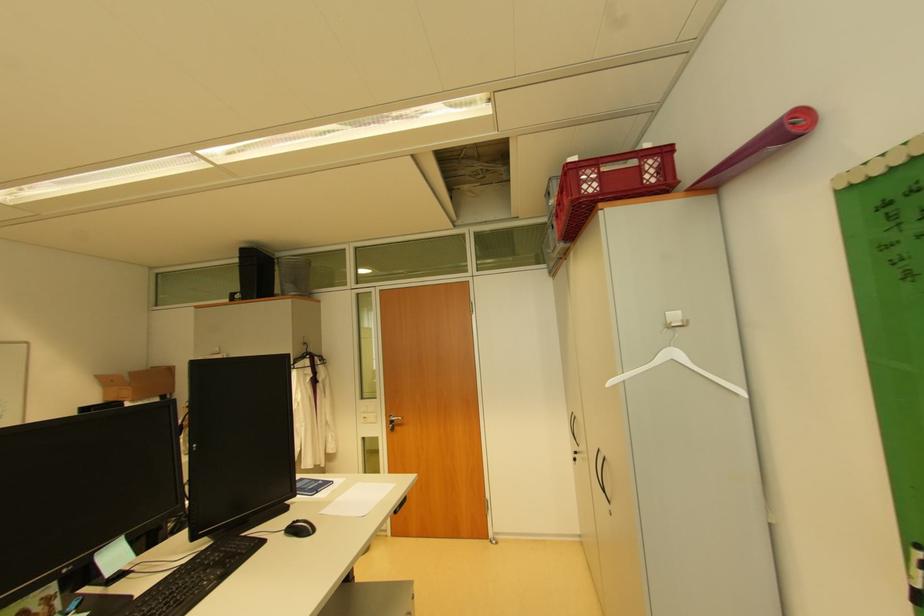
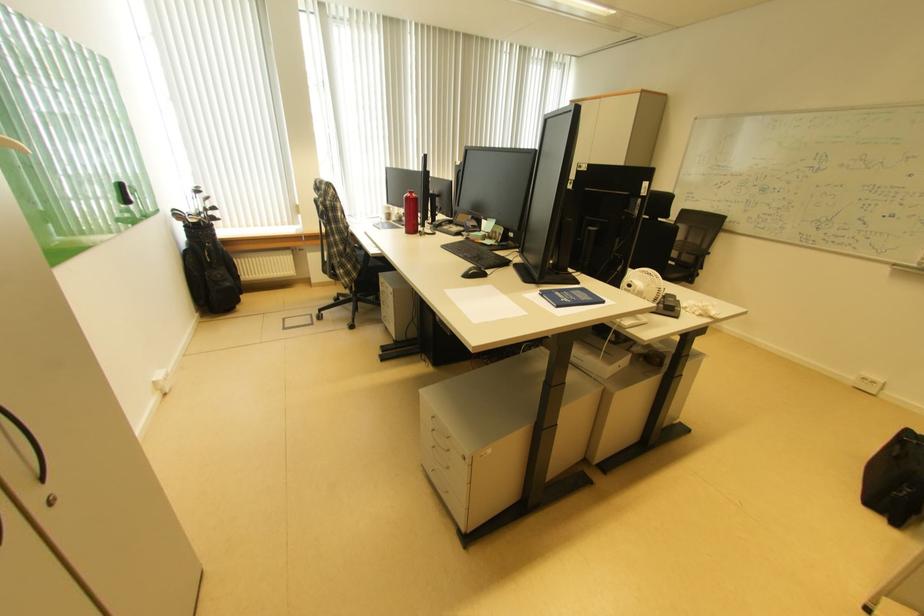
Find the pixel in the second image that matches [325,493] in the first image.

(551, 297)